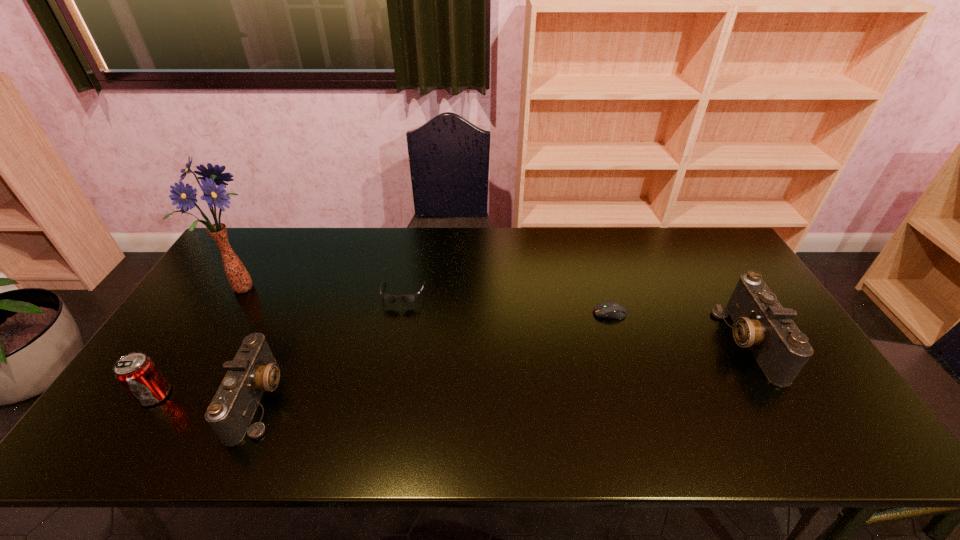
Where is `the fourth closest object relative to the taller camera`? The width and height of the screenshot is (960, 540). the fourth closest object relative to the taller camera is located at coordinates (238, 277).

Locate which object ranks fifth in proximity to the right camera. Please provide its 2D coordinates. Your answer should be formatted as a tuple, i.e. [(x, y)], where the tuple contains the x and y coordinates of a point satisfying the conditions above.

[(137, 373)]

This screenshot has width=960, height=540. What are the coordinates of `free space that satisfies the following two spatial constraints: 1. on the back side of the pop soda; 2. on the right side of the tallest object` in the screenshot? It's located at (224, 288).